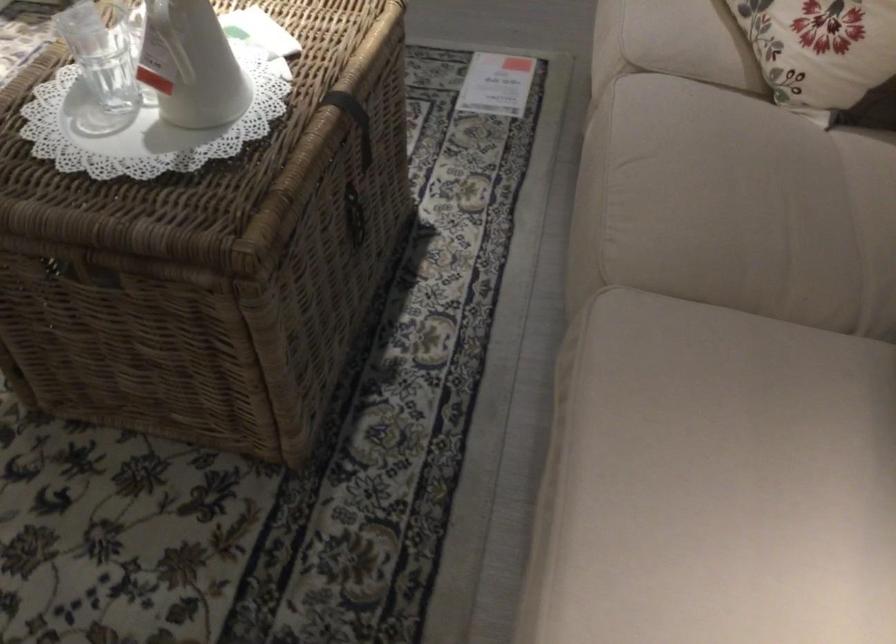
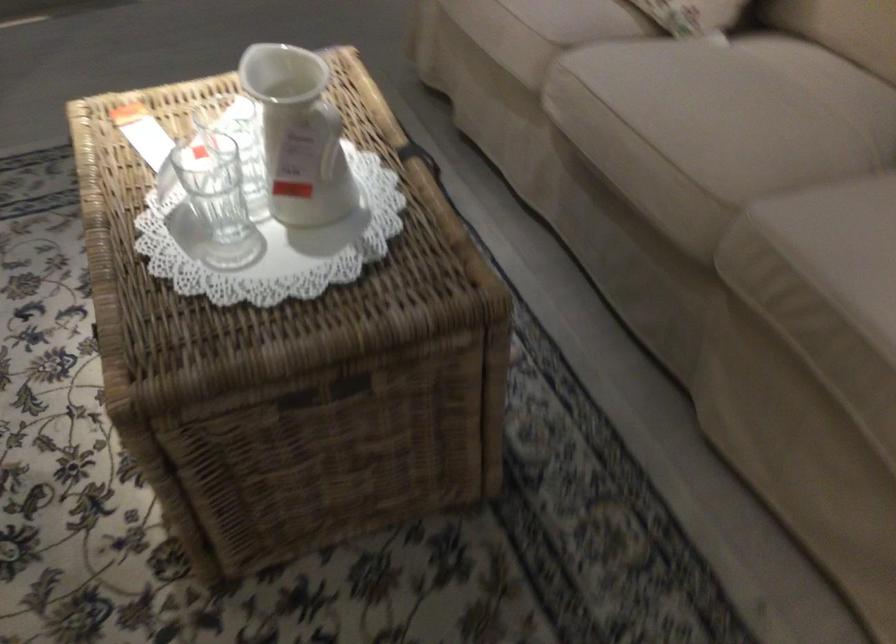
Where in the second image is the point corresponding to the point at 624,234 from the first image?

(704, 167)